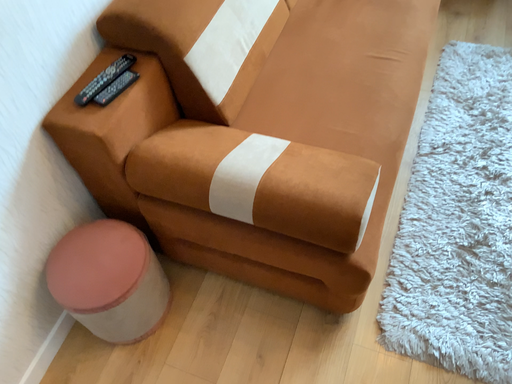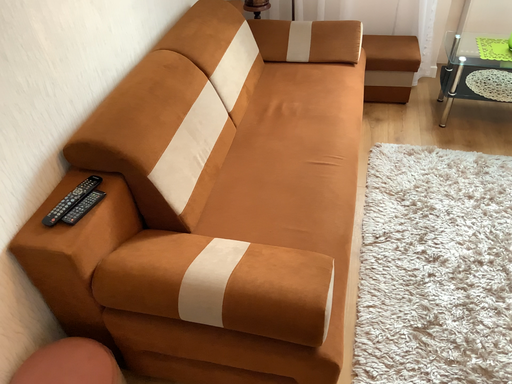
Question: How did the camera likely rotate when shooting the video?

Choices:
 (A) rotated upward
 (B) rotated downward

Answer: (A)